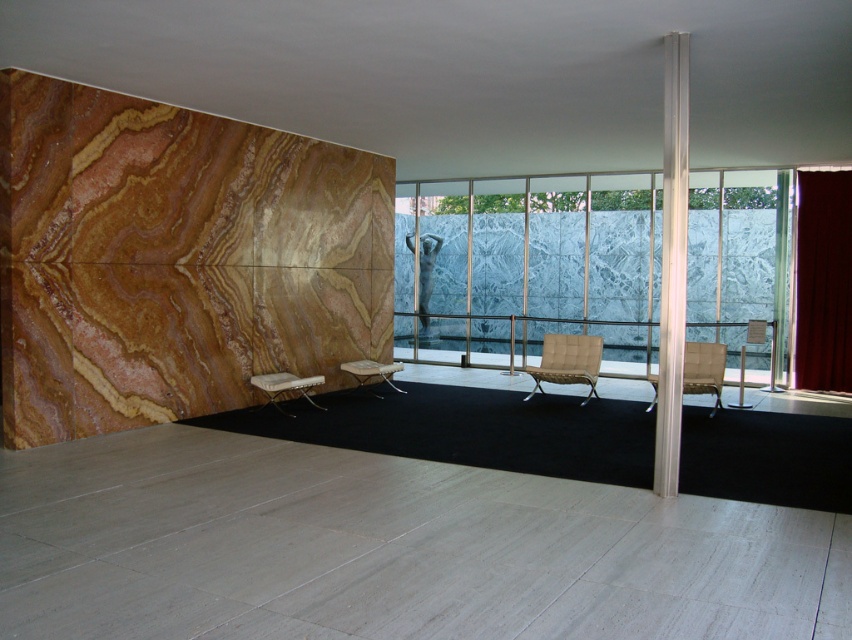
You are planning to place a large potted plant between the light beige fabric armchair at right and the white woven fabric armchair at center. Given their sizes, which armchair should the plant be closer to?

The light beige fabric armchair at right is larger in size than the white woven fabric armchair at center, so the plant should be placed closer to the white woven fabric armchair at center to balance the space.

You are sitting on the beige leather armchair at center and want to get up to walk to the door located at the back of the room. Which direction should you move to reach the door without going around the light beige fabric armchair at right?

Since the light beige fabric armchair at right is behind the beige leather armchair at center, you should move backward to reach the door located at the back of the room without going around the light beige fabric armchair at right.